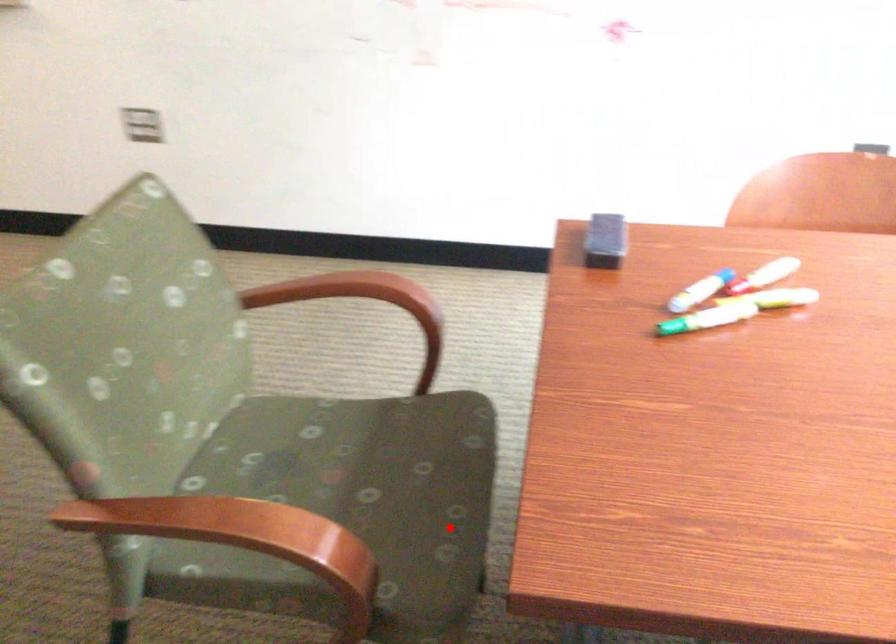
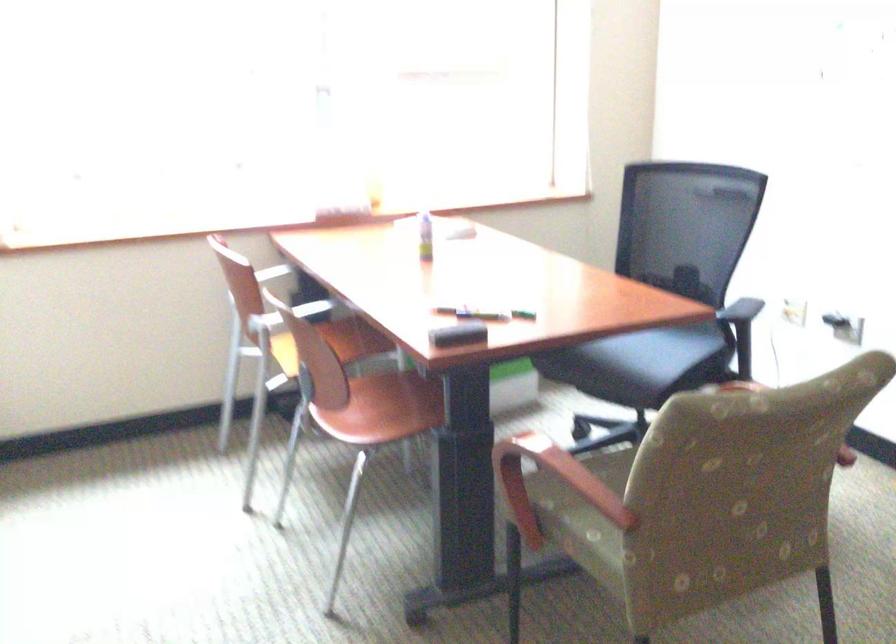
Locate, in the second image, the point that corresponds to the highlighted location in the first image.

(616, 460)